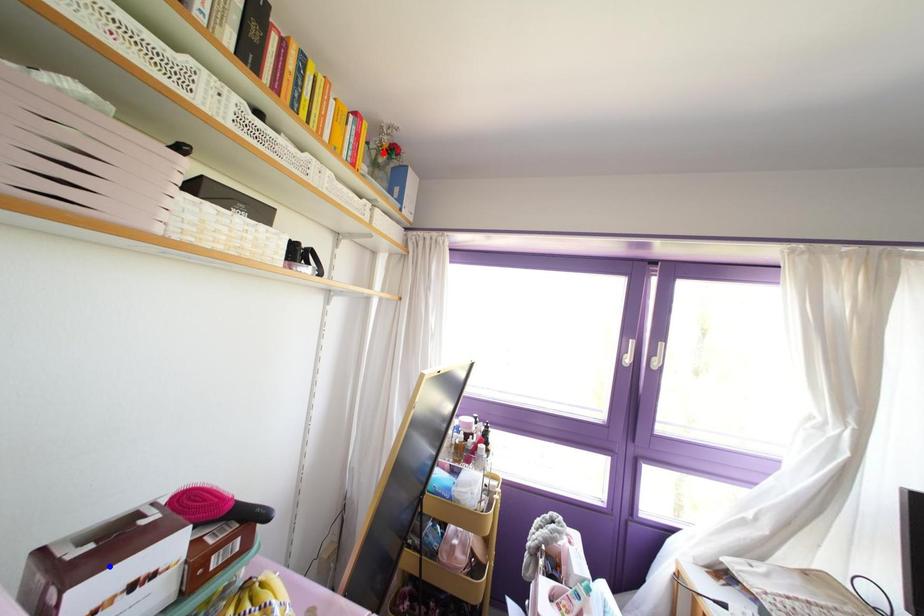
Question: Which of the two points in the image is closer to the camera?

Choices:
 (A) Blue point is closer.
 (B) Red point is closer.

Answer: (A)